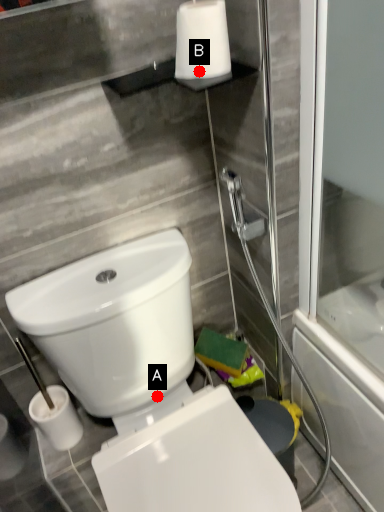
Question: Two points are circled on the image, labeled by A and B beside each circle. Among these points, which one is farthest from the camera?

Choices:
 (A) A is further
 (B) B is further

Answer: (A)